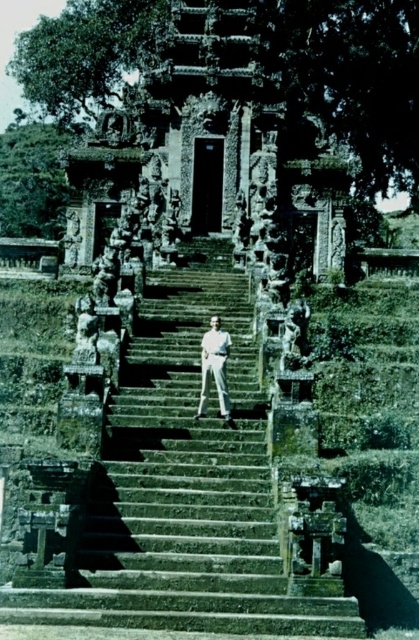
You are a tour guide explaining the historical site to visitors. You point to the green stone stairs at center and the white cotton pants at center. How far apart are these two items?

The green stone stairs at center and white cotton pants at center are 5.10 meters apart from each other.

Consider the image. You are a photographer planning to take a photo of the green stone stairs at center and the white cotton pants at center. Which object should you focus on first if you want to capture both in a single shot without zooming in or out?

The green stone stairs at center has a larger size compared to the white cotton pants at center, so you should focus on the green stone stairs at center first to ensure it fills the frame appropriately before adjusting for the smaller white cotton pants at center.